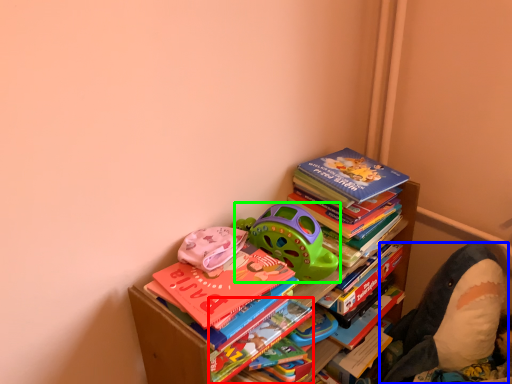
Question: Which is nearer to the paperback book (highlighted by a red box)? toy (highlighted by a blue box) or toy (highlighted by a green box).

Choices:
 (A) toy
 (B) toy

Answer: (B)